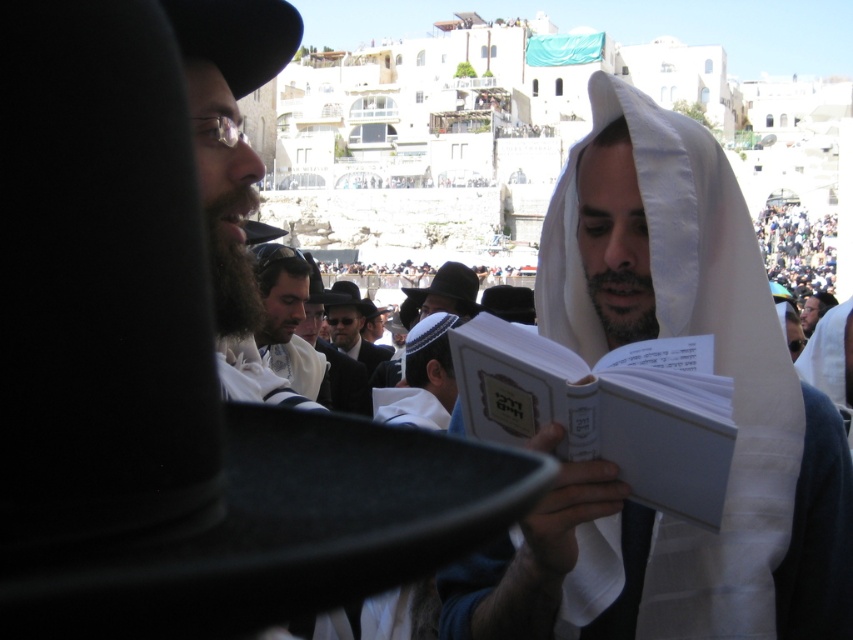
You are standing at the front of the gathering and need to pass a message to both the person in dark gray clothing at upper right and the matte black suit at center. Which one is farther away from you?

The dark gray clothing at upper right is 152.78 feet away from matte black suit at center, so the dark gray clothing at upper right is farther away from you.